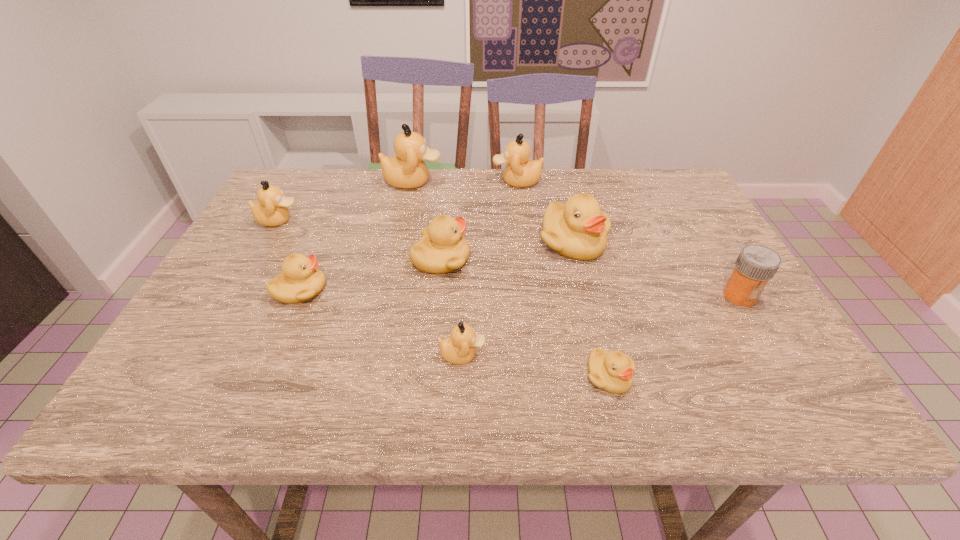
Locate an element on the screen. This screenshot has width=960, height=540. the leftmost yellow duckling is located at coordinates (300, 280).

Find the location of `the nearest tan duckling`. the nearest tan duckling is located at coordinates (460, 348).

This screenshot has height=540, width=960. Identify the location of the second tan duckling from right to left. (460, 348).

Find the location of a particular element. the nearest yellow duckling is located at coordinates pyautogui.click(x=612, y=371).

Where is `the shortest object`? The width and height of the screenshot is (960, 540). the shortest object is located at coordinates (612, 371).

At what (x,y) coordinates should I click in order to perform the action: click on free region located on the face of the biggest tan duckling. Please return your answer as a coordinate pair (x, y). Looking at the image, I should click on (472, 181).

This screenshot has height=540, width=960. I want to click on vacant space located 0.090m on the face of the second biggest tan duckling, so click(x=463, y=181).

Where is `vacant region located 0.120m on the face of the second biggest tan duckling`? vacant region located 0.120m on the face of the second biggest tan duckling is located at coordinates (452, 181).

Find the location of `free space located on the face of the second biggest tan duckling`. free space located on the face of the second biggest tan duckling is located at coordinates (416, 181).

Where is `free space located on the front-facing side of the biggest yellow duckling`? The height and width of the screenshot is (540, 960). free space located on the front-facing side of the biggest yellow duckling is located at coordinates (606, 373).